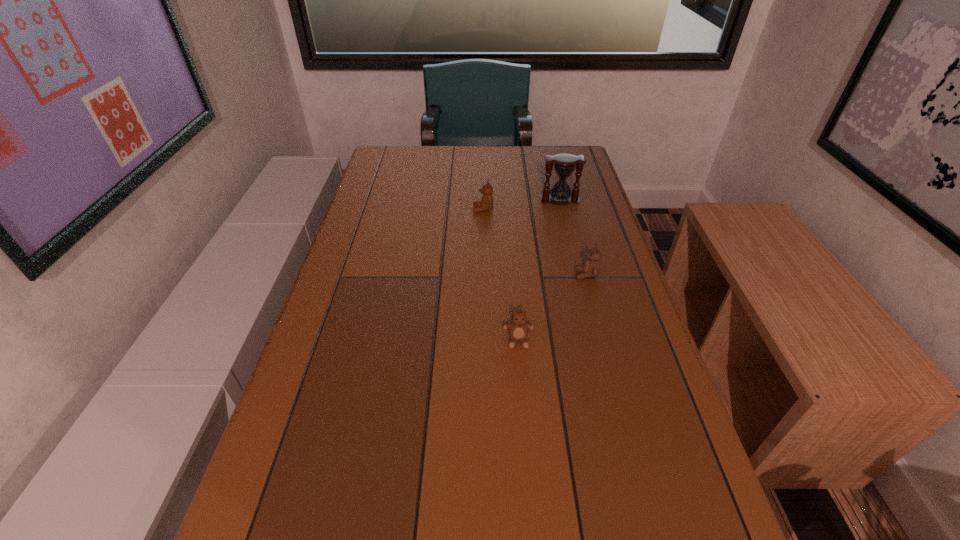
At what (x,y) coordinates should I click in order to perform the action: click on the tallest object. Please return your answer as a coordinate pair (x, y). Looking at the image, I should click on (564, 165).

Find the location of a particular element. This screenshot has height=540, width=960. the leftmost object is located at coordinates (486, 204).

This screenshot has height=540, width=960. I want to click on the leftmost teddy bear, so click(x=486, y=204).

This screenshot has height=540, width=960. Find the location of `the second nearest object`. the second nearest object is located at coordinates (591, 268).

The height and width of the screenshot is (540, 960). What are the coordinates of `the rightmost teddy bear` in the screenshot? It's located at (591, 268).

I want to click on the second object from left to right, so click(x=518, y=329).

This screenshot has width=960, height=540. I want to click on the nearest teddy bear, so click(x=518, y=329).

Find the location of a particular element. The height and width of the screenshot is (540, 960). free location located 0.090m on the back of the tallest object is located at coordinates (555, 180).

At what (x,y) coordinates should I click in order to perform the action: click on vacant space situated on the face of the leftmost teddy bear. Please return your answer as a coordinate pair (x, y). Looking at the image, I should click on pos(382,210).

This screenshot has height=540, width=960. In order to click on vacant space located 0.060m on the face of the leftmost teddy bear in this screenshot , I will do `click(453, 210)`.